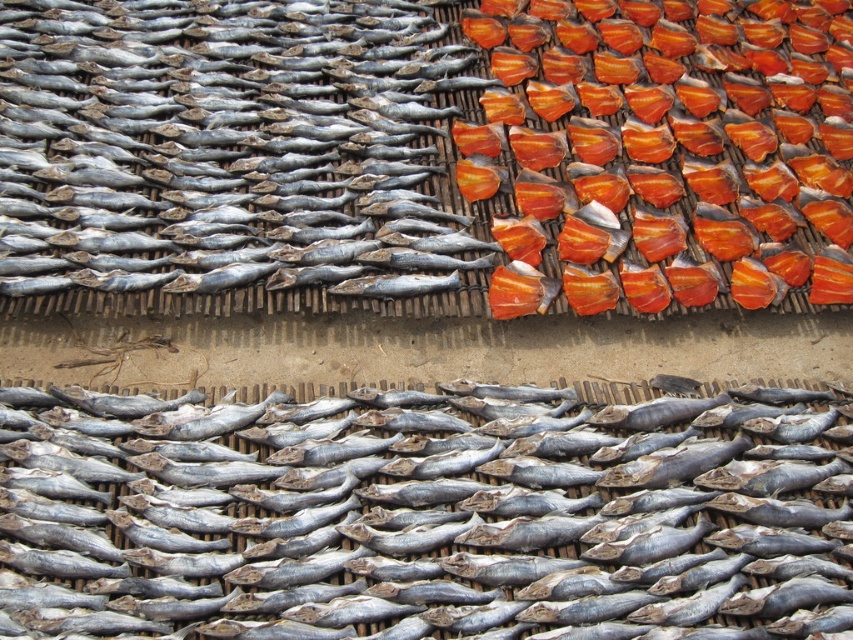
Find the location of `silvery matte fish at upper left`. silvery matte fish at upper left is located at coordinates (210, 140).

Who is positioned more to the right, silvery matte fish at upper left or orange-red dried fish at upper right?

orange-red dried fish at upper right

Is point (431, 156) closer to camera compared to point (683, 108)?

Yes.

Where is `silvery matte fish at upper left`? The width and height of the screenshot is (853, 640). silvery matte fish at upper left is located at coordinates (210, 140).

From the picture: Can you confirm if grayish matte fish at center is positioned to the right of silvery matte fish at upper left?

Correct, you'll find grayish matte fish at center to the right of silvery matte fish at upper left.

Locate an element on the screen. This screenshot has height=640, width=853. grayish matte fish at center is located at coordinates (430, 520).

Can you confirm if grayish matte fish at center is positioned above orange-red dried fish at upper right?

Incorrect, grayish matte fish at center is not positioned above orange-red dried fish at upper right.

Which is in front, point (813, 552) or point (720, 228)?

Point (813, 552) is more forward.

Which is in front, point (474, 432) or point (592, 115)?

Positioned in front is point (474, 432).

Locate an element on the screen. grayish matte fish at center is located at coordinates (430, 520).